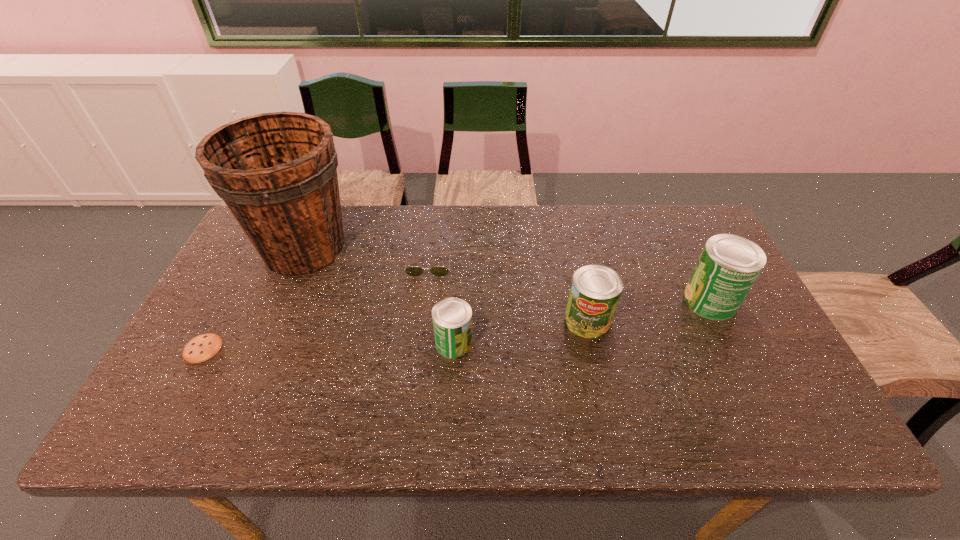
This screenshot has width=960, height=540. In order to click on free space located 0.260m on the right of the third tallest object in this screenshot , I will do `click(709, 321)`.

Locate an element on the screen. The height and width of the screenshot is (540, 960). blank space located 0.060m on the back of the tallest can is located at coordinates (694, 267).

The image size is (960, 540). What are the coordinates of `blank space located 0.080m on the front of the bucket` in the screenshot? It's located at tap(279, 308).

The height and width of the screenshot is (540, 960). What are the coordinates of `vacant area situated on the front-facing side of the sunglasses` in the screenshot? It's located at (x=421, y=333).

You are a GUI agent. You are given a task and a screenshot of the screen. Output one action in this format:
    pyautogui.click(x=<x>, y=<y>)
    Task: Click on the free point located 0.370m on the back of the shortest object
    The image size is (960, 540).
    Given the screenshot: What is the action you would take?
    click(261, 240)

At what (x,y) coordinates should I click in order to perform the action: click on bucket present at the far edge. Please return your answer as a coordinate pair (x, y). The width and height of the screenshot is (960, 540). Looking at the image, I should click on (x=277, y=172).

In order to click on sunglasses that is at the far edge in this screenshot , I will do `click(413, 271)`.

The image size is (960, 540). What are the coordinates of `bucket that is at the left edge` in the screenshot? It's located at (277, 172).

Identify the location of cookie present at the left edge. Image resolution: width=960 pixels, height=540 pixels. (203, 347).

At what (x,y) coordinates should I click in order to perform the action: click on object located in the right edge section of the desktop. Please return your answer as a coordinate pair (x, y). Looking at the image, I should click on (729, 264).